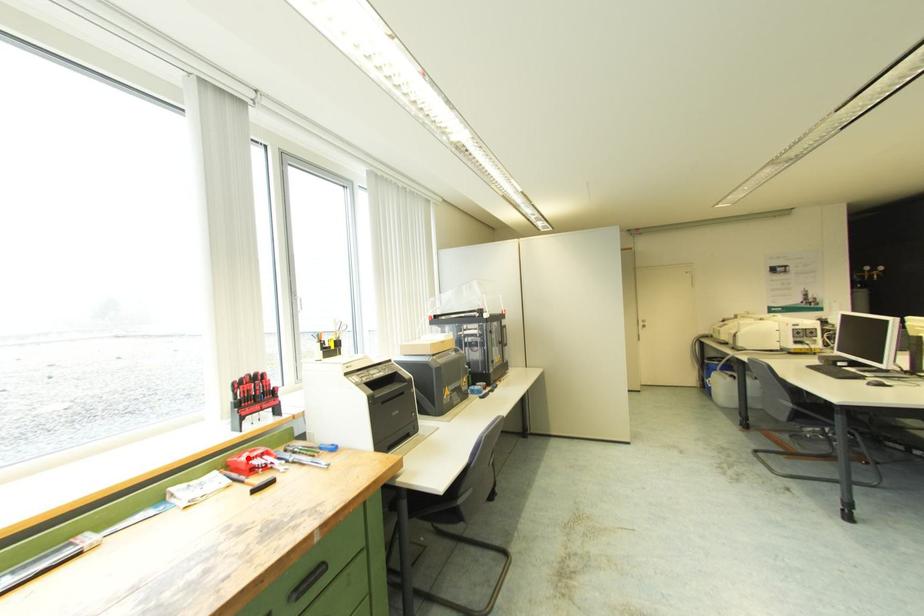
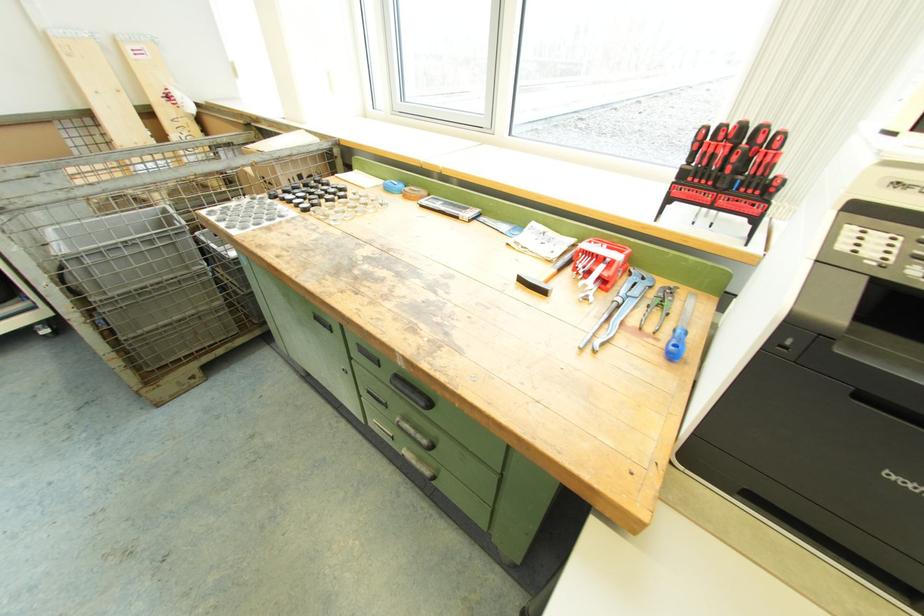
Where in the second image is the point corresponding to the highlighted location from the first image?

(588, 246)